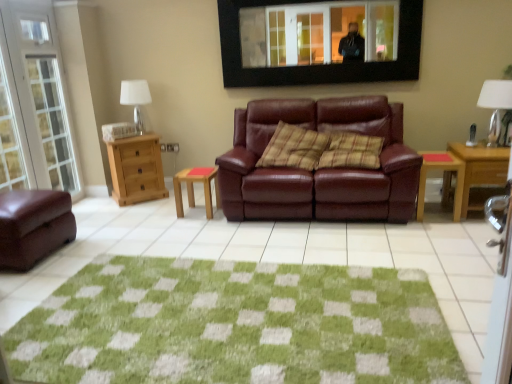
Where is `vacant area located to the right-hand side of matte brown leather ottoman at lower left, which appears as the first studio couch when viewed from the left`? Image resolution: width=512 pixels, height=384 pixels. vacant area located to the right-hand side of matte brown leather ottoman at lower left, which appears as the first studio couch when viewed from the left is located at coordinates (93, 243).